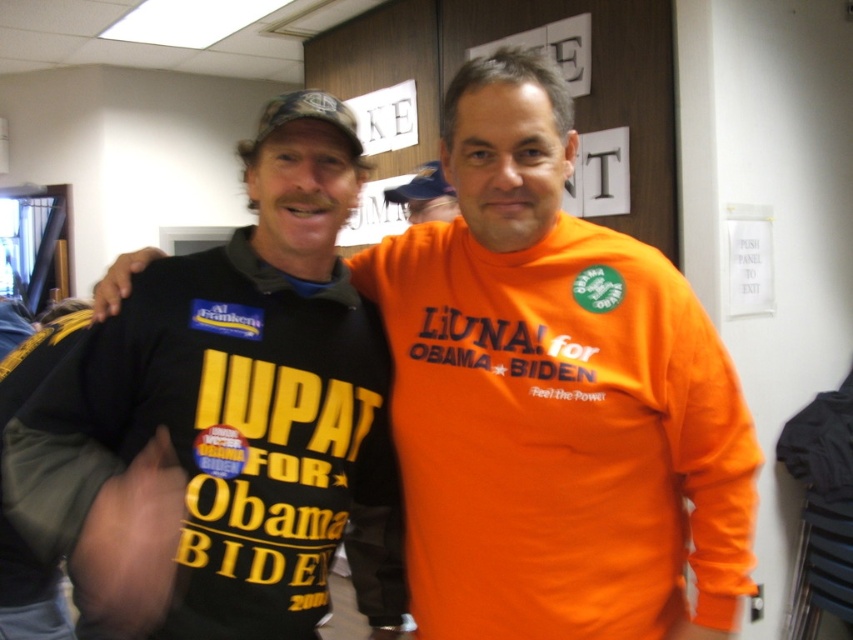
You are a photographer at the event and want to focus on the person on the right. The point you selected is at coordinates point (219,413). Based on the scene description, which person is this point located on?

The point (219,413) is located on the matte black t shirt at left, so it is on the person on the left.